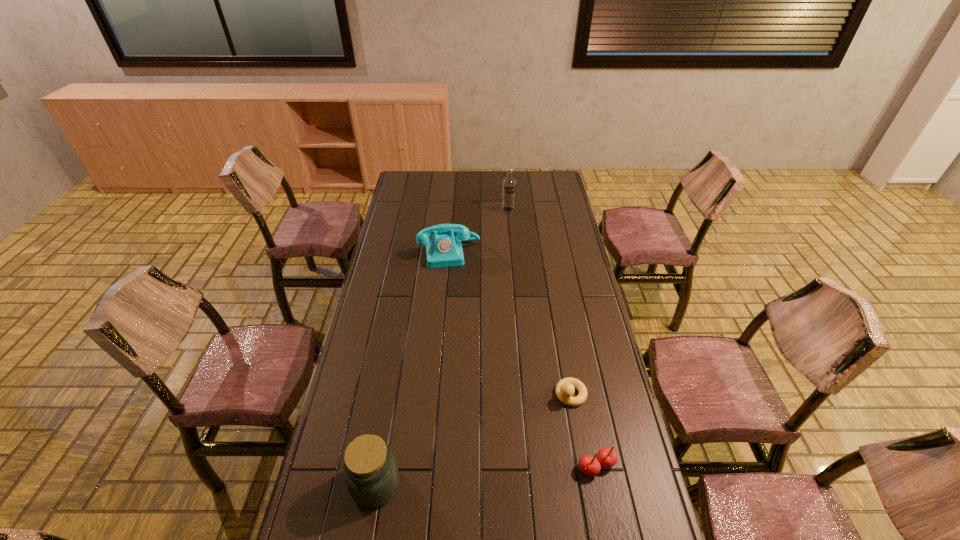
You are a GUI agent. You are given a task and a screenshot of the screen. Output one action in this format:
    pyautogui.click(x=<x>, y=<y>)
    Task: Click on the cherry that is at the right edge
    This screenshot has width=960, height=540.
    Given the screenshot: What is the action you would take?
    pyautogui.click(x=607, y=457)

The height and width of the screenshot is (540, 960). I want to click on duckling located at the right edge, so click(x=564, y=390).

The width and height of the screenshot is (960, 540). In order to click on object situated at the near left corner in this screenshot , I will do `click(371, 474)`.

Find the location of a particular element. The height and width of the screenshot is (540, 960). vacant space at the far edge of the desktop is located at coordinates (430, 189).

Identify the location of free region at the left edge of the desktop. (411, 206).

Find the location of `free location at the right edge`. free location at the right edge is located at coordinates tap(551, 202).

You are a GUI agent. You are given a task and a screenshot of the screen. Output one action in this format:
    pyautogui.click(x=<x>, y=<y>)
    Task: Click on the vacant space at the near right corner of the desktop
    
    Given the screenshot: What is the action you would take?
    pyautogui.click(x=616, y=530)

Locate an element on the screen. This screenshot has width=960, height=540. empty location between the cherry and the fourth nearest object is located at coordinates (523, 360).

The image size is (960, 540). In order to click on empty space that is in between the jar and the third nearest object in this screenshot , I will do `click(473, 439)`.

The width and height of the screenshot is (960, 540). Find the location of `free space between the tallest object and the jar`. free space between the tallest object and the jar is located at coordinates (442, 347).